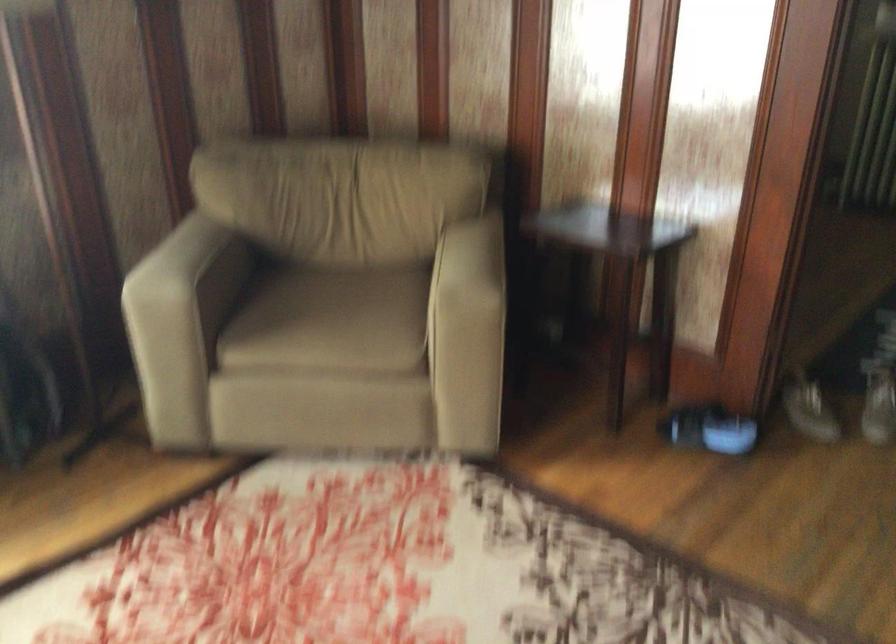
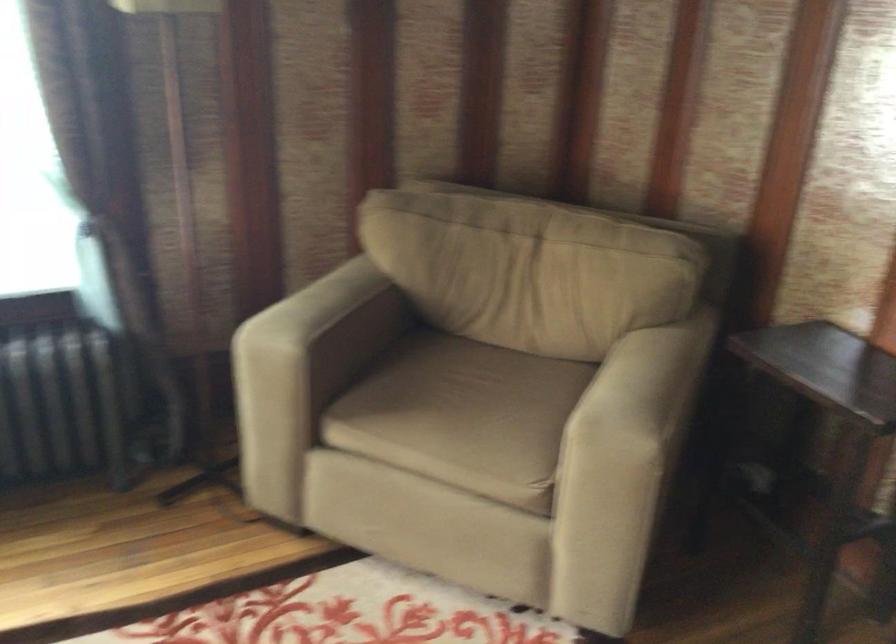
Locate, in the second image, the point that corresponds to (x=487, y=281) in the first image.

(640, 413)